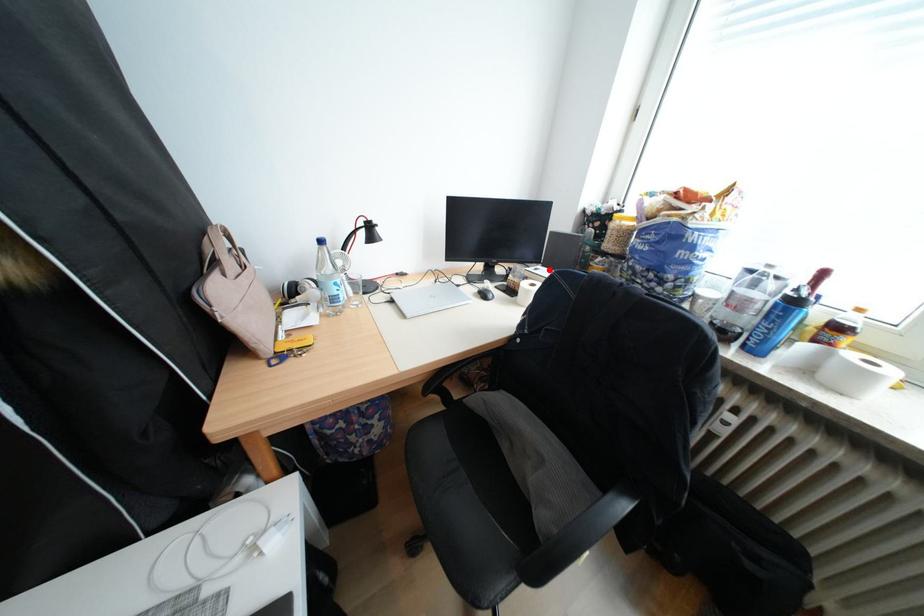
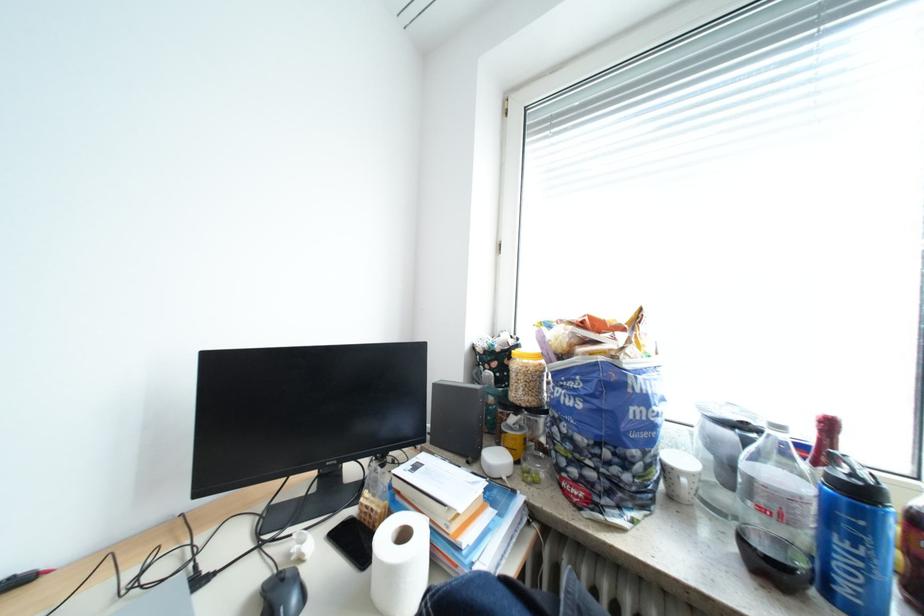
Where in the second image is the point corresponding to the highlighted location from the first image?

(428, 468)